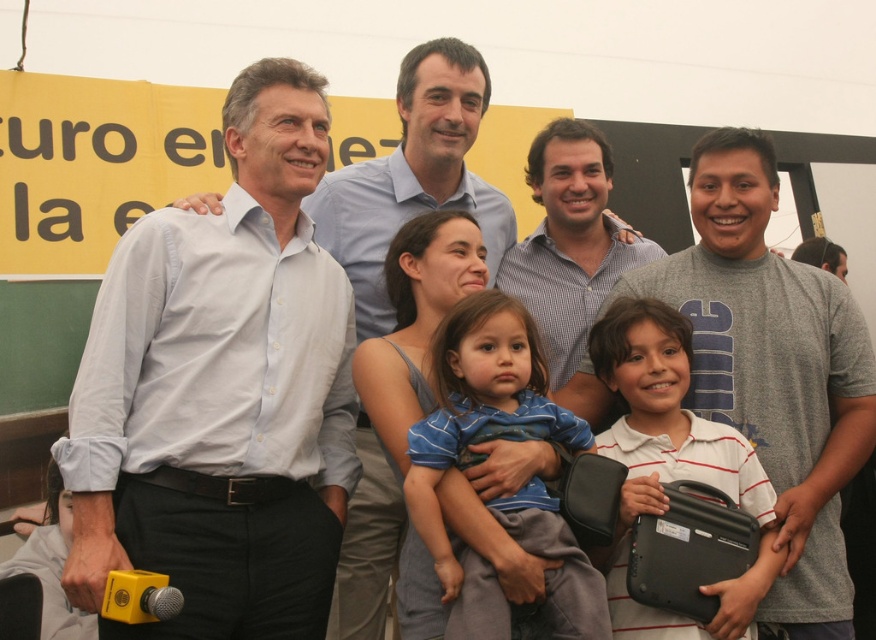
You are standing in front of the group photo and want to identify the person wearing the white shirt at center. Based on their position relative to the checkered shirt at center, where would you look?

You should look to the left of the checkered shirt at center because the white shirt at center is positioned to its left.

You are taking a photo of the group and want to focus on both the point at coordinates point (505, 321) and point (542, 189). Which point should you adjust your focus to first to ensure both are in focus?

Since point (505, 321) is closer to the camera than point (542, 189), you should focus on point (505, 321) first to ensure both points are within the depth of field.